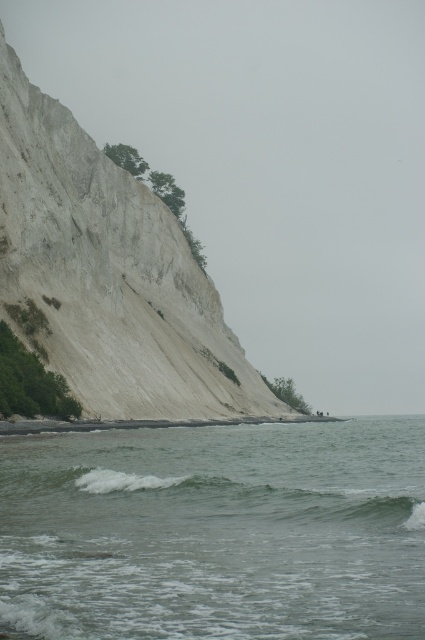
Is greenish water at lower center to the left of white sandy cliff at upper left from the viewer's perspective?

In fact, greenish water at lower center is to the right of white sandy cliff at upper left.

Does greenish water at lower center appear under white sandy cliff at upper left?

Yes, greenish water at lower center is below white sandy cliff at upper left.

Between point (308, 508) and point (189, 296), which one is positioned behind?

The point (189, 296) is more distant.

What are the coordinates of `greenish water at lower center` in the screenshot? It's located at (215, 532).

Is point (209, 572) behind point (54, 481)?

No.

Can you confirm if greenish water at lower center is wider than green matte wave at lower center?

Yes.

Which is in front, point (22, 440) or point (197, 496)?

Point (197, 496)

Where is `greenish water at lower center`? Image resolution: width=425 pixels, height=640 pixels. greenish water at lower center is located at coordinates (215, 532).

Locate an element on the screen. The width and height of the screenshot is (425, 640). white sandy cliff at upper left is located at coordinates (110, 276).

Who is more forward, (231, 412) or (390, 531)?

Point (390, 531)

Is point (31, 141) less distant than point (407, 486)?

No, (31, 141) is behind (407, 486).

I want to click on white sandy cliff at upper left, so click(110, 276).